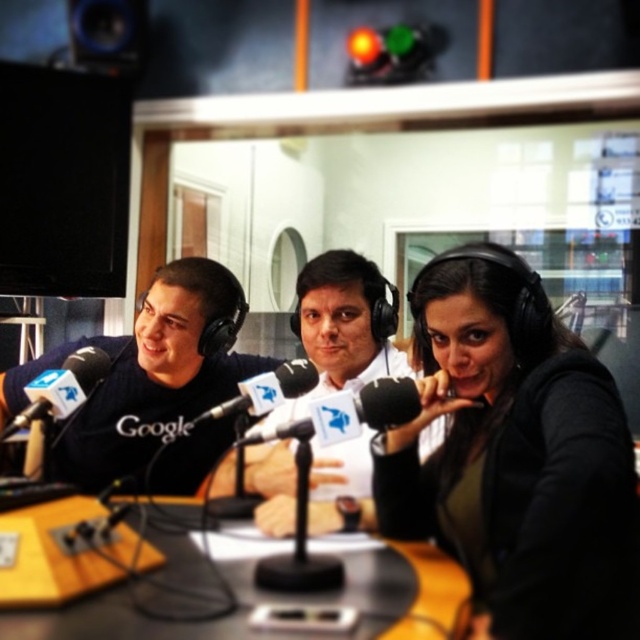
Can you confirm if black matte microphone at left is positioned to the left of black matte microphone at center?

Yes, black matte microphone at left is to the left of black matte microphone at center.

Can you confirm if black matte microphone at left is positioned to the right of black matte microphone at center?

No, black matte microphone at left is not to the right of black matte microphone at center.

This screenshot has width=640, height=640. I want to click on black matte microphone at left, so click(64, 388).

Is yellow wood table at center to the right of black matte microphone at center from the viewer's perspective?

Correct, you'll find yellow wood table at center to the right of black matte microphone at center.

Which is in front, point (38, 589) or point (284, 362)?

Point (38, 589) is more forward.

Locate an element on the screen. yellow wood table at center is located at coordinates (284, 600).

Who is more forward, (84, 465) or (144, 38)?

Point (84, 465)

Is black matte shirt at left positioned in front of blue matte speaker at upper left?

Yes.

At what (x,y) coordinates should I click in order to perform the action: click on black matte shirt at left. Please return your answer as a coordinate pair (x, y). Looking at the image, I should click on (147, 374).